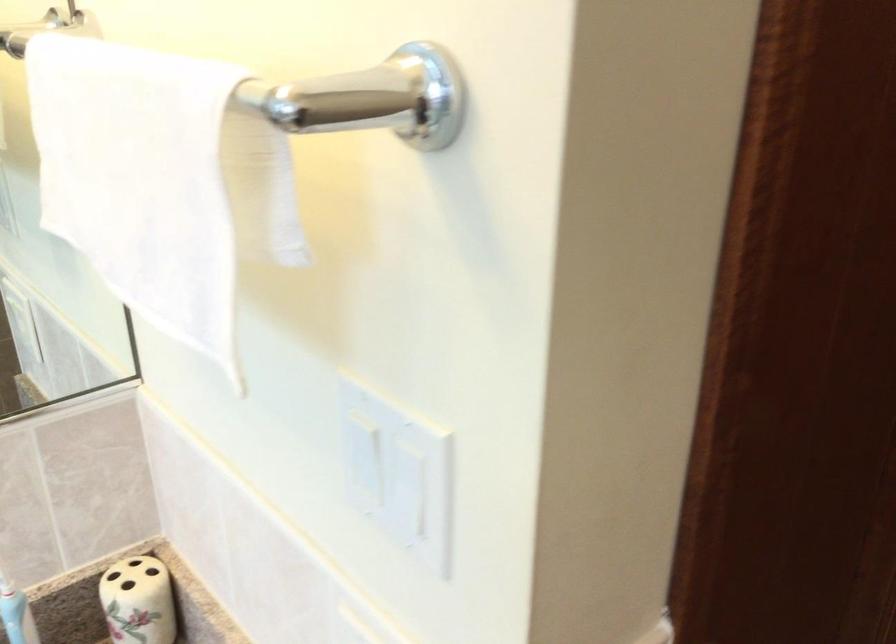
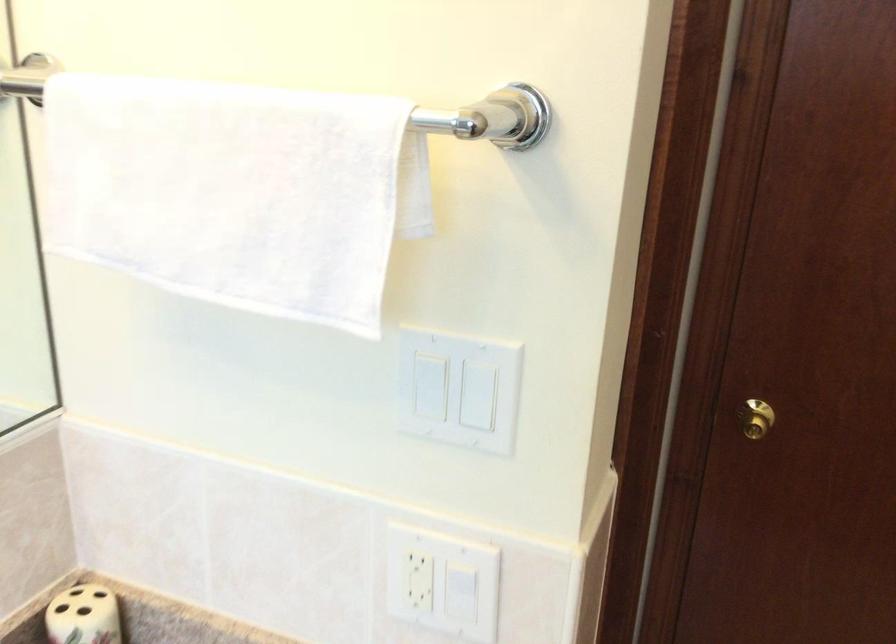
In the second image, find the point that corresponds to pixel 378 451 in the first image.

(429, 386)